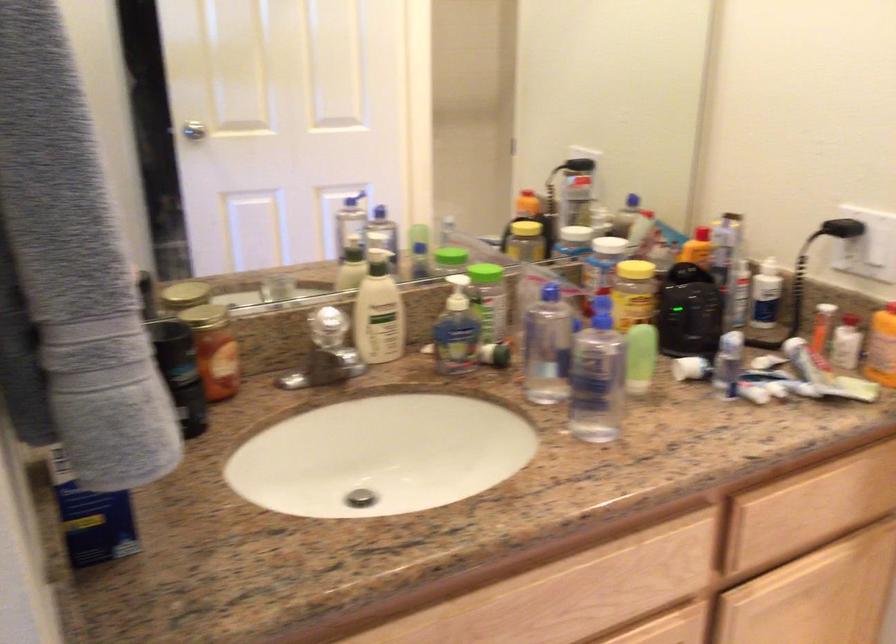
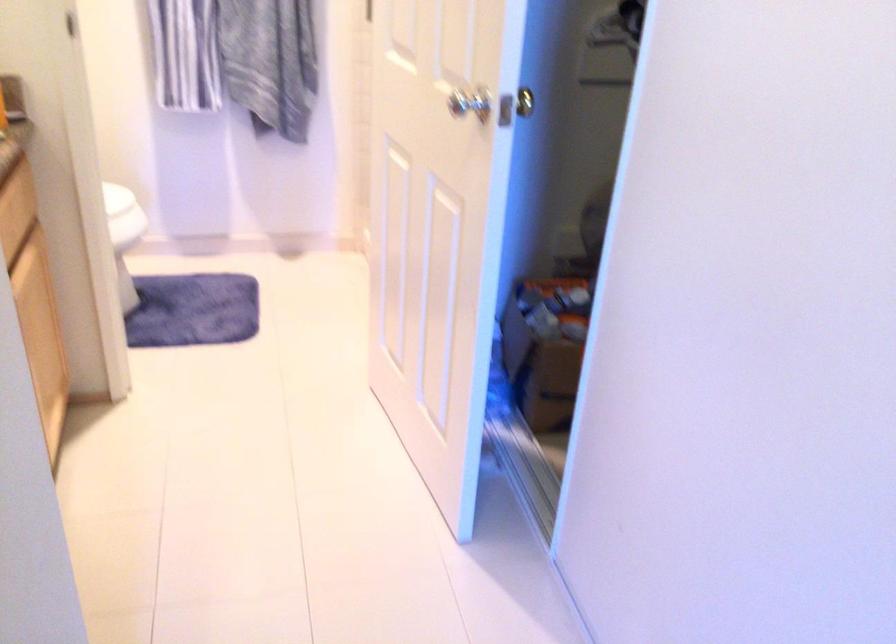
Locate, in the second image, the point that corresponds to (x=757, y=518) in the first image.

(12, 229)